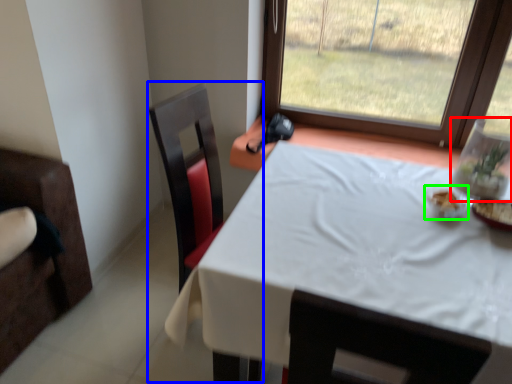
Question: Considering the real-world distances, which object is farthest from glass vase (highlighted by a red box)? swivel chair (highlighted by a blue box) or tableware (highlighted by a green box)?

Choices:
 (A) swivel chair
 (B) tableware

Answer: (A)